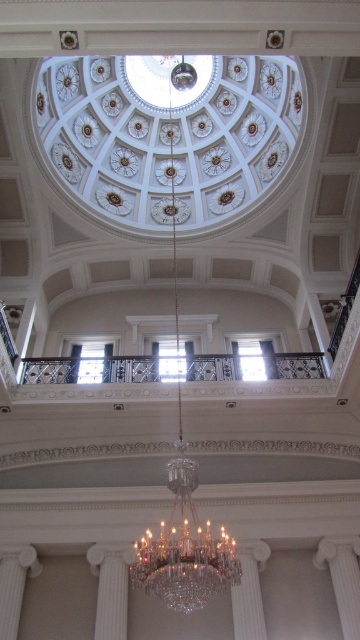
You are standing in the grand building and want to take a photo. You notice two points marked in the scene. Which point, point (114, 596) or point (249, 570), will appear larger in your camera view?

Point (114, 596) is closer to the camera than point (249, 570), so it will appear larger in the camera view.